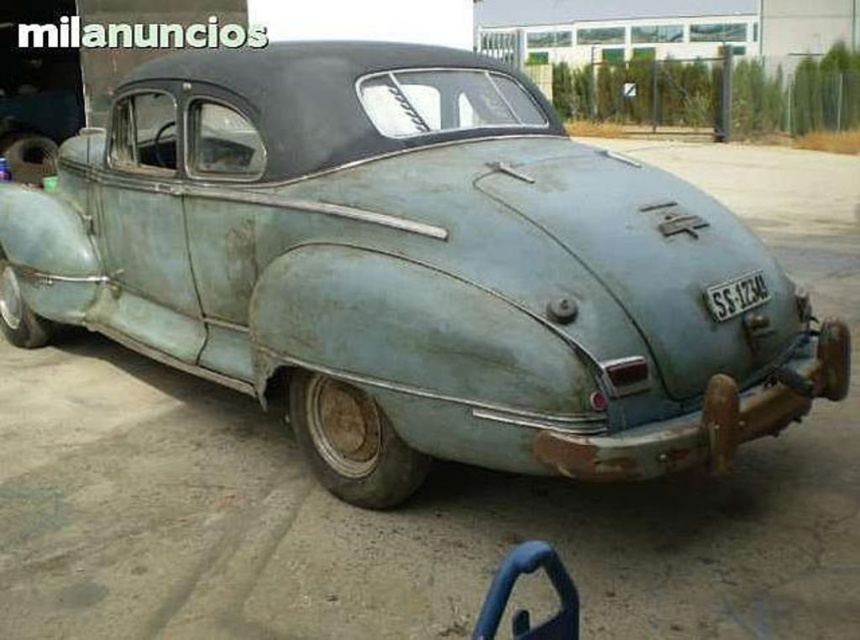
Consider the image. You are a photographer trying to capture the rusty metallic car at center and the metallic gray license plate at center in a single frame. Given that your camera can only focus on objects wider than 1 meter, will both objects meet the focus requirement?

The rusty metallic car at center has a greater width than the metallic gray license plate at center. Since the car is wider than the license plate, and the camera requires objects wider than 1 meter to focus, the car likely meets the requirement, but the license plate might be too narrow. However, without knowing the exact width of either, we can only confirm the car is wider than the plate. If the car is over 1 meter wide, both could qualify, but the license plate might not. The description doesn

You are a mechanic trying to repair the rusty metallic car at center. You need to reach the metallic gray license plate at center to replace it. Can you reach it without moving the car?

The rusty metallic car at center and the metallic gray license plate at center are 1.46 meters apart, so if the mechanic can reach 1.46 meters, they can replace the license plate without moving the car.

You are standing at the front of the vintage car and looking towards the rear. You notice two points marked on the car. The first point is at coordinates point (25, 260) and the second is at point (734, 280). Which point is closer to the rear of the car?

Point (25, 260) is behind point (734, 280), so it is closer to the rear of the car.